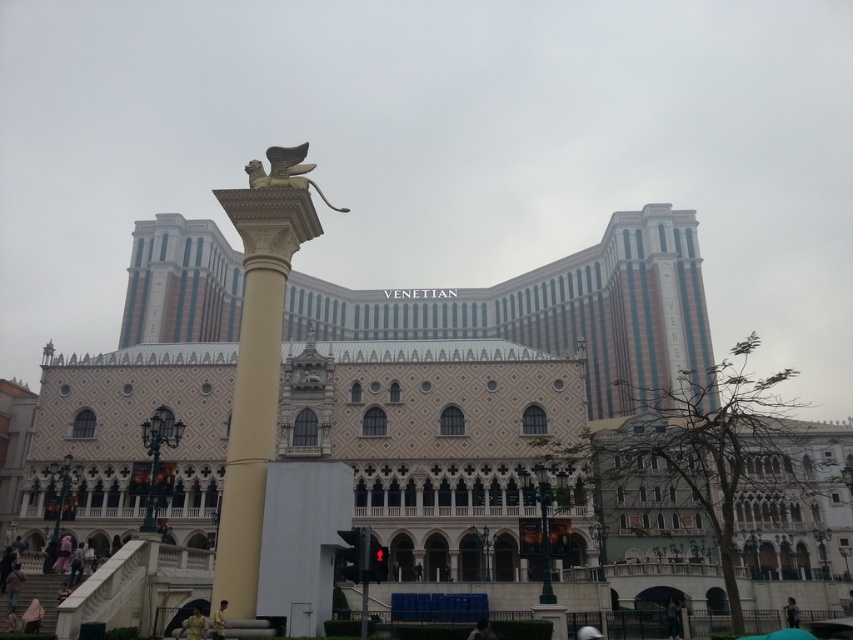
Who is taller, gold polished column at center or dark gray fabric jacket at lower right?

With more height is gold polished column at center.

Who is positioned more to the right, gold polished column at center or dark gray fabric jacket at lower right?

dark gray fabric jacket at lower right is more to the right.

Describe the element at coordinates (258, 356) in the screenshot. I see `gold polished column at center` at that location.

Find the location of a particular element. This screenshot has width=853, height=640. gold polished column at center is located at coordinates (258, 356).

Who is higher up, light brown leather jacket at lower center or dark gray fabric jacket at lower right?

Positioned higher is light brown leather jacket at lower center.

Does light brown leather jacket at lower center appear under dark gray fabric jacket at lower right?

No.

Does point (199, 618) lie behind point (788, 598)?

No, it is not.

Identify the location of light brown leather jacket at lower center. The image size is (853, 640). (194, 625).

Image resolution: width=853 pixels, height=640 pixels. I want to click on dark blue fabric at lower center, so click(480, 630).

How far apart are dark blue fabric at lower center and dark gray fabric jacket at lower right?

The distance of dark blue fabric at lower center from dark gray fabric jacket at lower right is 73.31 feet.

Is point (492, 636) farther from viewer compared to point (790, 600)?

No, (492, 636) is in front of (790, 600).

In order to click on dark blue fabric at lower center in this screenshot , I will do (480, 630).